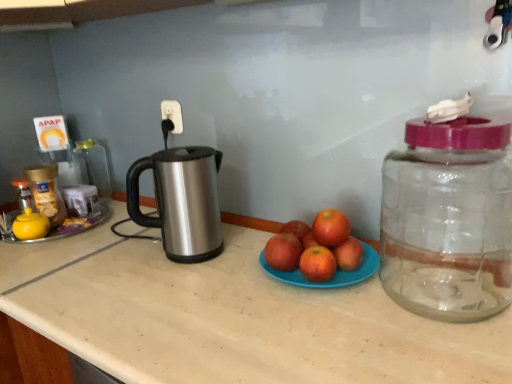
Identify the location of free space to the left of satin silver kettle at left. (118, 261).